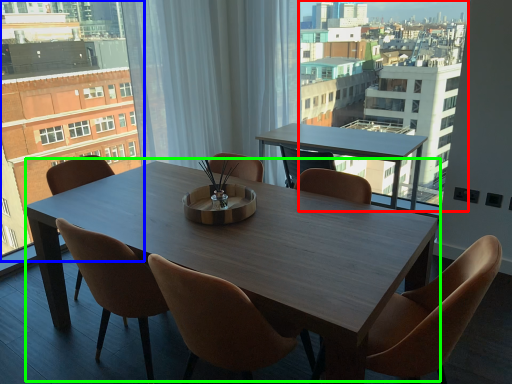
Question: Which object is positioned farthest from condominium (highlighted by a red box)? Select from condominium (highlighted by a blue box) and kitchen & dining room table (highlighted by a green box).

Choices:
 (A) condominium
 (B) kitchen & dining room table

Answer: (A)